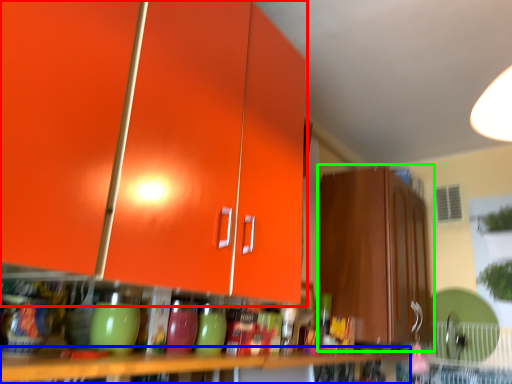
Question: Based on their relative distances, which object is nearer to cabinetry (highlighted by a red box)? Choose from table (highlighted by a blue box) and cabinetry (highlighted by a green box).

Choices:
 (A) table
 (B) cabinetry

Answer: (A)